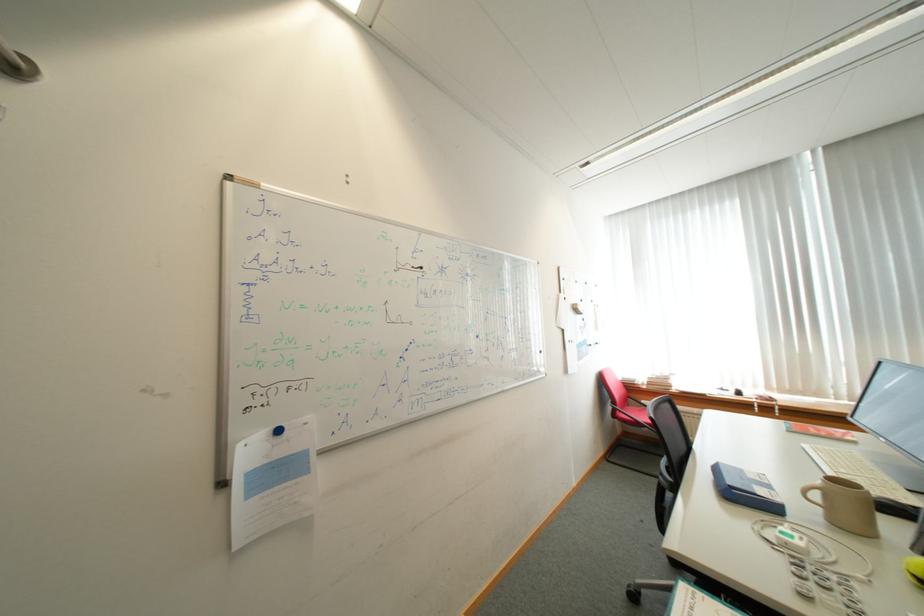
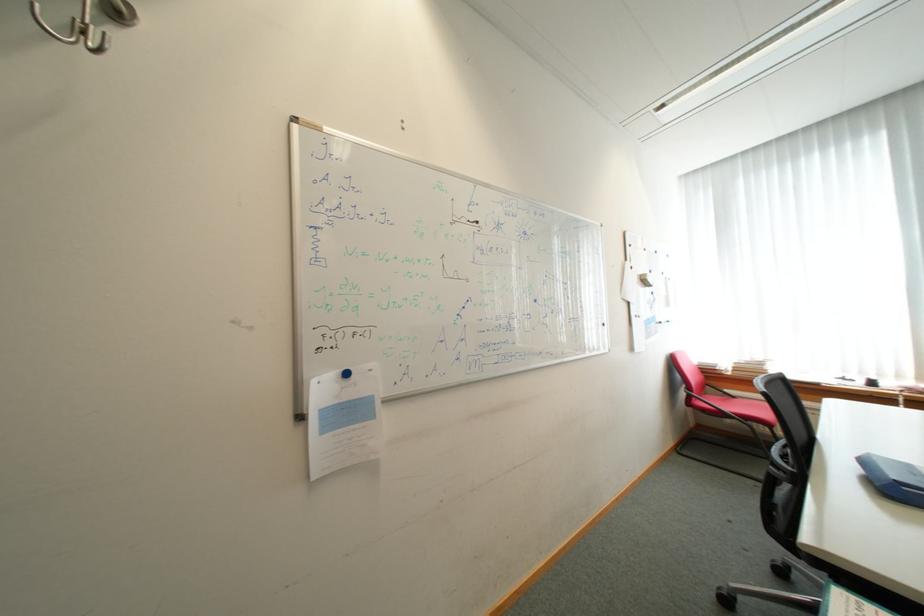
Locate, in the second image, the point that corresponds to (743,488) in the first image.

(912, 485)